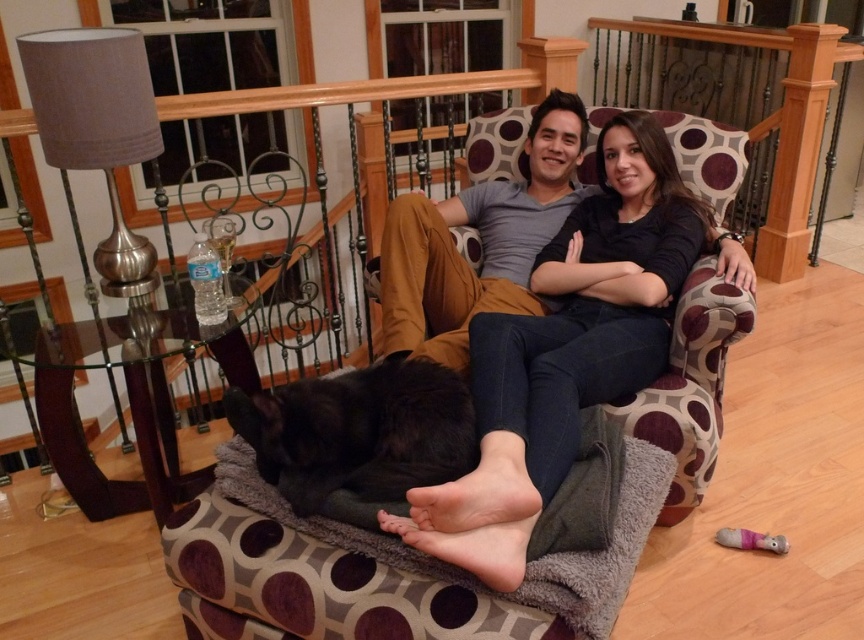
Does matte gray shirt at center have a smaller size compared to black fluffy dog at center?

No, matte gray shirt at center is not smaller than black fluffy dog at center.

Is point (448, 316) more distant than point (396, 381)?

Yes, point (448, 316) is farther from viewer.

At what (x,y) coordinates should I click in order to perform the action: click on matte gray shirt at center. Please return your answer as a coordinate pair (x, y). The width and height of the screenshot is (864, 640). Looking at the image, I should click on (480, 243).

From the picture: Which is below, dark blue jeans at center or soft gray fabric dog bed at center?

soft gray fabric dog bed at center is lower down.

Is the position of dark blue jeans at center less distant than that of soft gray fabric dog bed at center?

No, it is behind soft gray fabric dog bed at center.

Does point (577, 308) come closer to viewer compared to point (226, 445)?

No, it is not.

Locate an element on the screen. dark blue jeans at center is located at coordinates (566, 352).

Is dark blue jeans at center in front of black fluffy dog at center?

Yes, it is.

Is dark blue jeans at center below black fluffy dog at center?

Incorrect, dark blue jeans at center is not positioned below black fluffy dog at center.

Is point (617, 209) farther from viewer compared to point (443, 442)?

Yes, it is behind point (443, 442).

This screenshot has height=640, width=864. In order to click on dark blue jeans at center in this screenshot , I will do `click(566, 352)`.